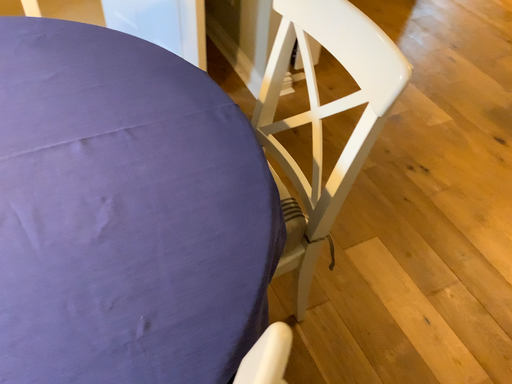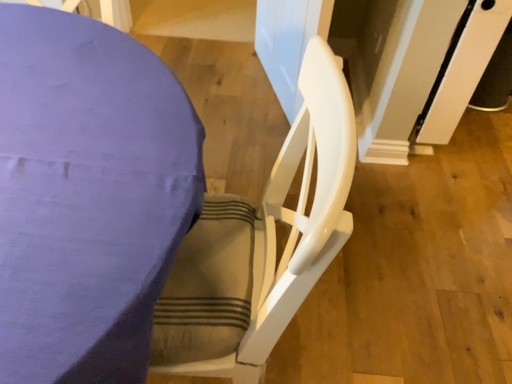
Question: Which way did the camera rotate in the video?

Choices:
 (A) rotated left
 (B) rotated right

Answer: (A)